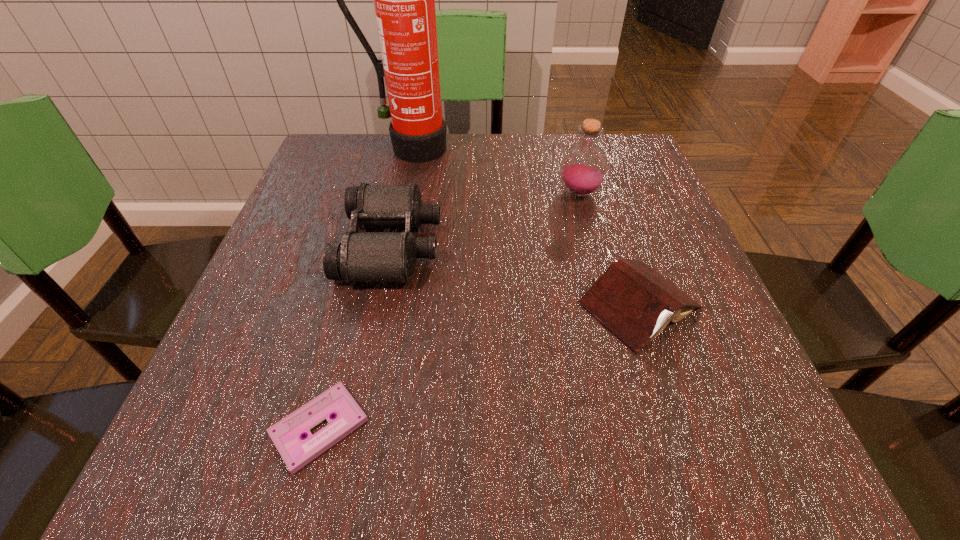
You are a GUI agent. You are given a task and a screenshot of the screen. Output one action in this format:
    pyautogui.click(x=<x>, y=<y>)
    Task: Click on the farthest object
    
    Given the screenshot: What is the action you would take?
    pyautogui.click(x=404, y=0)

The image size is (960, 540). I want to click on the tallest object, so click(x=404, y=0).

The height and width of the screenshot is (540, 960). Find the location of `bottle`. bottle is located at coordinates (583, 168).

I want to click on binoculars, so click(361, 256).

Where is `the second shortest object`? This screenshot has height=540, width=960. the second shortest object is located at coordinates [x=635, y=302].

I want to click on the nearest object, so click(287, 434).

Where is `videotape`? Image resolution: width=960 pixels, height=540 pixels. videotape is located at coordinates (287, 434).

The image size is (960, 540). In order to click on free space located 0.360m on the front-facing side of the fire extinguisher in this screenshot , I will do `click(383, 274)`.

At what (x,y) coordinates should I click in order to perform the action: click on free space located 0.110m on the left of the fourth shortest object. Please return your answer as a coordinate pair (x, y). The width and height of the screenshot is (960, 540). Looking at the image, I should click on (506, 193).

At what (x,y) coordinates should I click in order to perform the action: click on free region located 0.300m through the eyepieces of the third shortest object. Please return your answer as a coordinate pair (x, y). The width and height of the screenshot is (960, 540). Looking at the image, I should click on (599, 245).